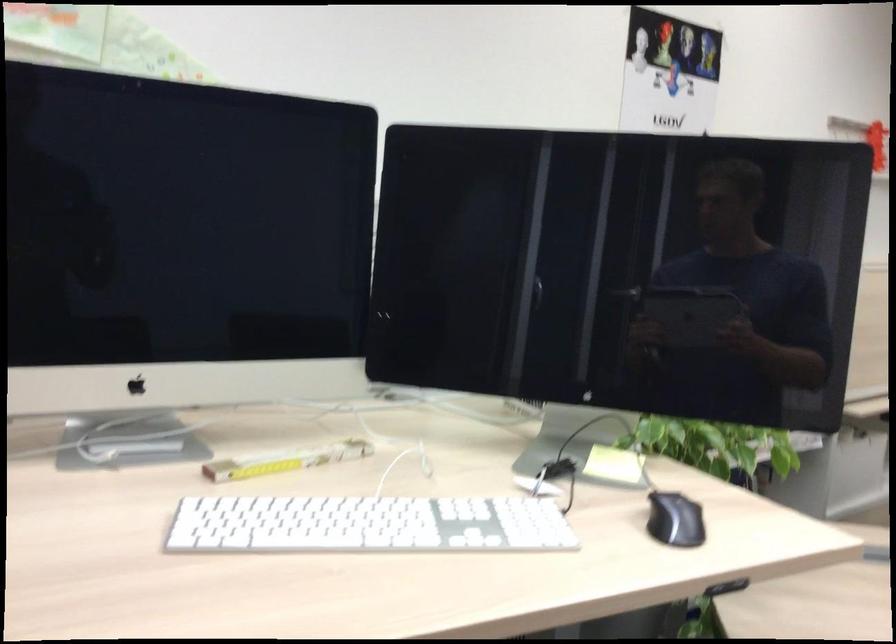
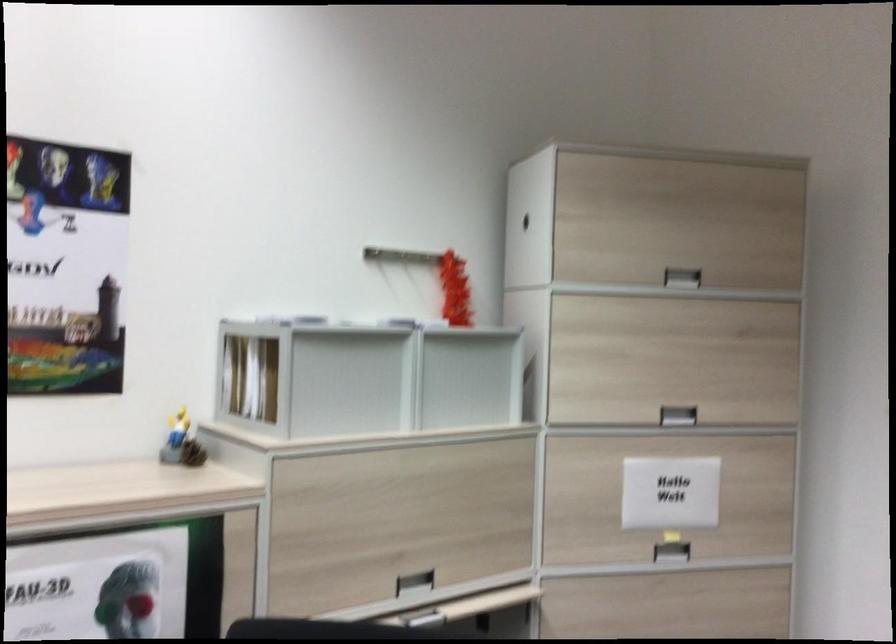
Question: What movement of the cameraman would produce the second image?

Choices:
 (A) Left
 (B) Right
 (C) Forward
 (D) Backward

Answer: (B)